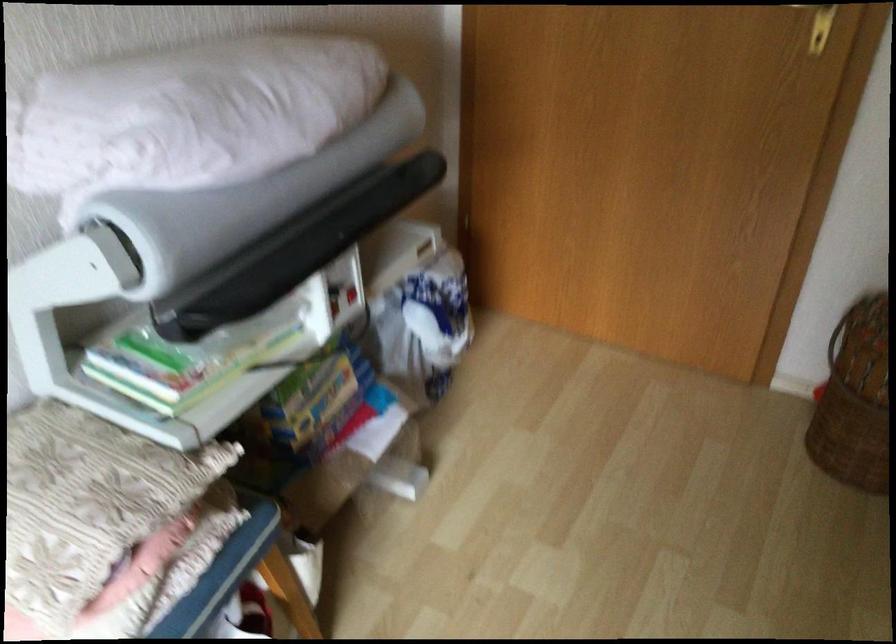
At what (x,y) coordinates should I click in order to perform the action: click on chair sitting surface. Please return your answer as a coordinate pair (x, y). Image resolution: width=896 pixels, height=644 pixels. Looking at the image, I should click on (222, 572).